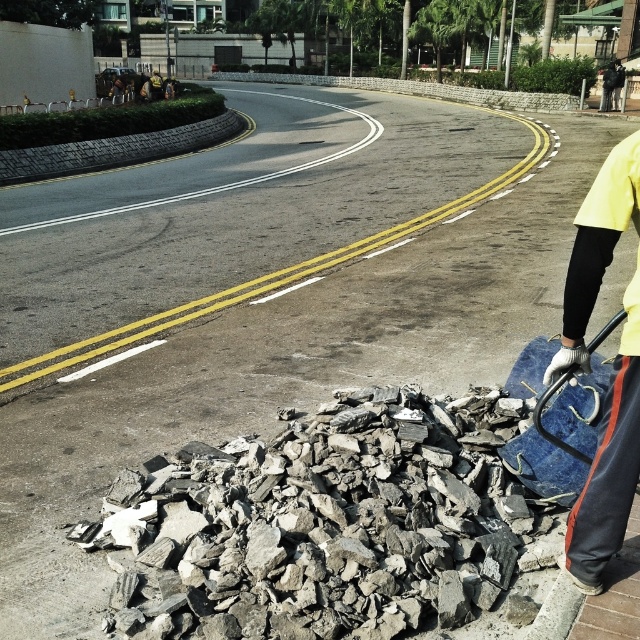
You are a delivery person trying to navigate through the construction site. You need to move from point A to point B. Point A is at coordinate point (275,529) and point B is at coordinate point (577,577). According to the scene description, which point is closer to you as you stand at the starting position?

Point (577,577) is closer to you because point (275,529) is behind it.

Looking at this image, you are a delivery person with a 1.5 meter wide cart. You need to navigate through the urban street scene shown. There is a gray rough rocks at lower center and a yellow fabric at right. Can your cart pass between them without touching either?

The gray rough rocks at lower center and yellow fabric at right are 1.89 meters apart from each other. Since your cart is 1.5 meters wide, there is enough space between them for the cart to pass through without touching either object.